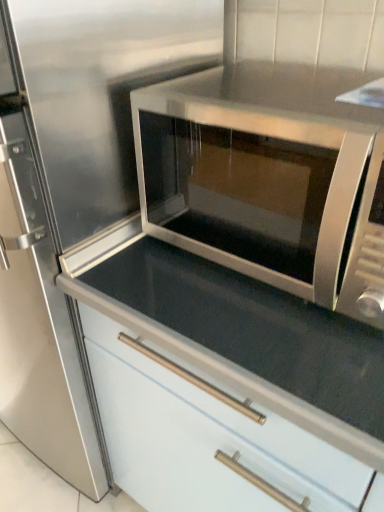
Question: From the image's perspective, is stainless steel microwave at center above or below white glossy cabinet at center?

Choices:
 (A) above
 (B) below

Answer: (A)

Question: Is stainless steel microwave at center in front of or behind white glossy cabinet at center in the image?

Choices:
 (A) front
 (B) behind

Answer: (A)

Question: Do you think stainless steel microwave at center is within white glossy cabinet at center, or outside of it?

Choices:
 (A) outside
 (B) inside

Answer: (A)

Question: In terms of size, does white glossy cabinet at center appear bigger or smaller than stainless steel microwave at center?

Choices:
 (A) small
 (B) big

Answer: (B)

Question: Is white glossy cabinet at center in front of or behind stainless steel microwave at center in the image?

Choices:
 (A) behind
 (B) front

Answer: (A)

Question: Considering the positions of point (263, 287) and point (233, 106), is point (263, 287) closer or farther from the camera than point (233, 106)?

Choices:
 (A) farther
 (B) closer

Answer: (A)

Question: From a real-world perspective, is white glossy cabinet at center above or below stainless steel microwave at center?

Choices:
 (A) above
 (B) below

Answer: (B)